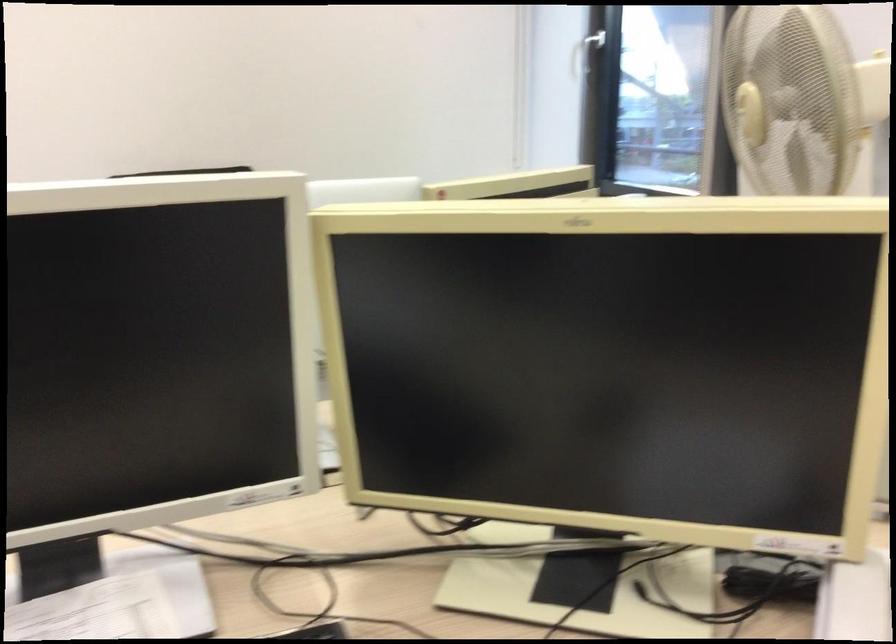
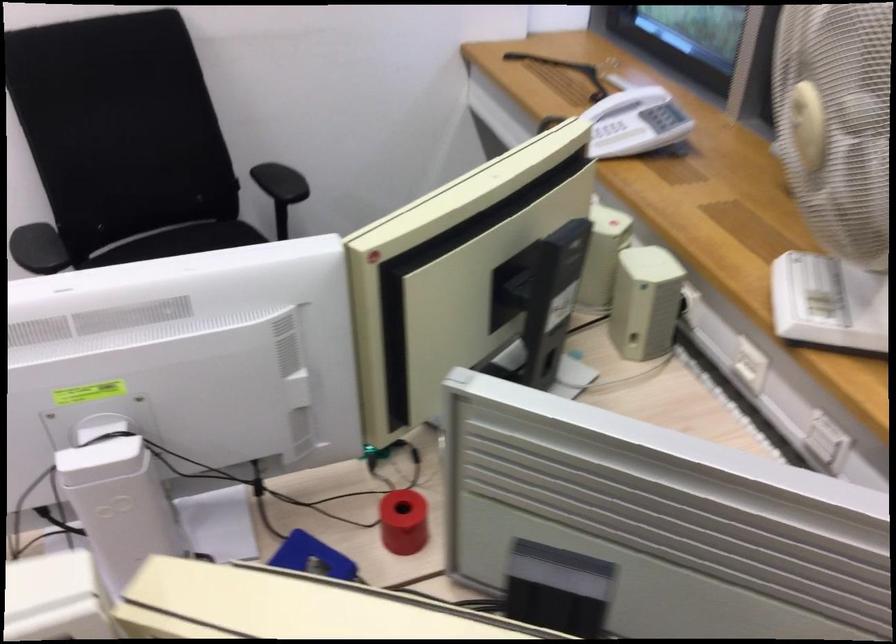
The point at (748, 104) is marked in the first image. Where is the corresponding point in the second image?

(807, 125)